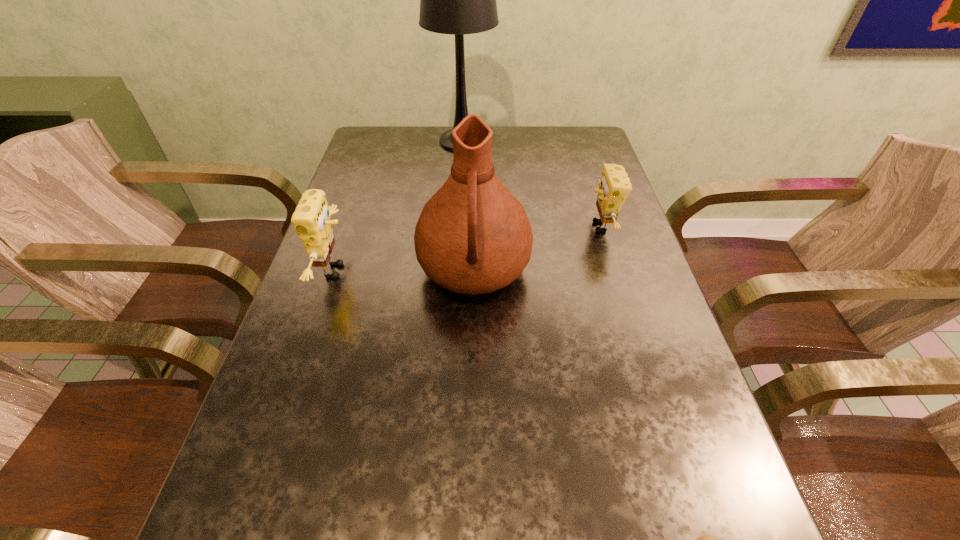
Identify the location of free space that is in between the shorter sponge and the tallest object. (532, 184).

Find the location of `free space between the shorter sponge and the fourth shortest object`. free space between the shorter sponge and the fourth shortest object is located at coordinates (538, 249).

Locate an element on the screen. free space between the second shortest object and the tallest object is located at coordinates (532, 184).

Where is `free spot between the third shortest object and the second tallest object`? The width and height of the screenshot is (960, 540). free spot between the third shortest object and the second tallest object is located at coordinates (405, 271).

Find the location of a particular element. The image size is (960, 540). empty space between the right sponge and the tallest object is located at coordinates [x=532, y=184].

This screenshot has width=960, height=540. What are the coordinates of `object that is the second closest to the tallest object` in the screenshot? It's located at (473, 236).

This screenshot has height=540, width=960. Identify the location of object that stands as the third closest to the second tallest object. (457, 0).

The height and width of the screenshot is (540, 960). Find the location of `free space that satisfies the following two spatial constraints: 1. on the face of the shorter sponge; 2. on the side of the pitcher with the handle`. free space that satisfies the following two spatial constraints: 1. on the face of the shorter sponge; 2. on the side of the pitcher with the handle is located at coordinates (614, 272).

At what (x,y) coordinates should I click in order to perform the action: click on free space that satisfies the following two spatial constraints: 1. on the face of the right sponge; 2. on the side of the fourth shortest object with the handle. Please return your answer as a coordinate pair (x, y). Image resolution: width=960 pixels, height=540 pixels. Looking at the image, I should click on (614, 272).